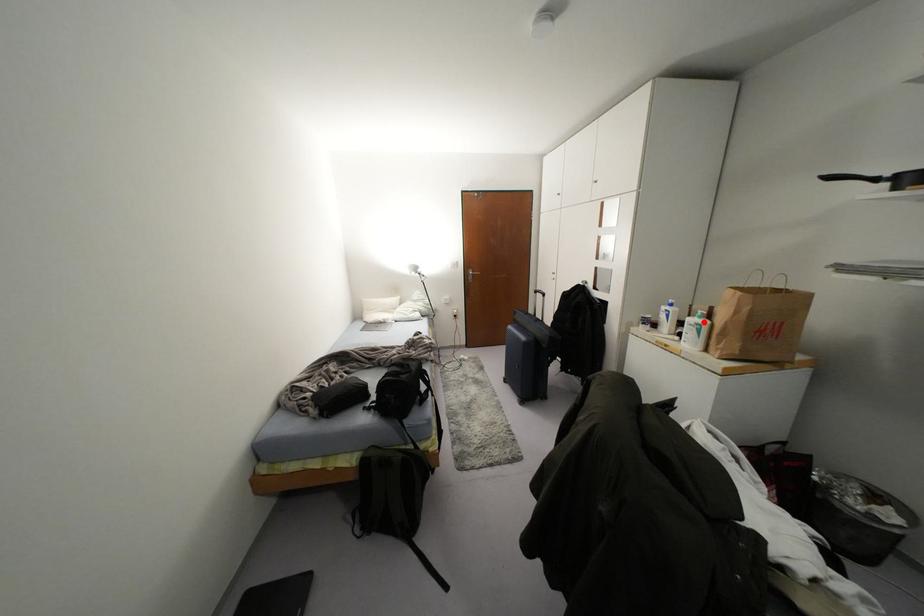
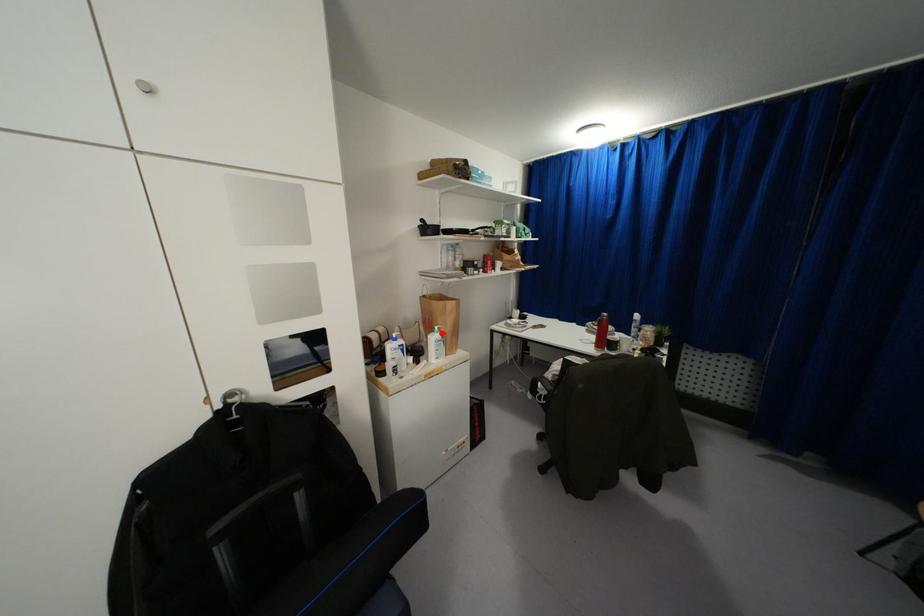
I am providing you with two images of the same scene from different viewpoints. A red point is marked on the first image and another point is marked on the second image. Does the point marked in image1 correspond to the same location as the one in image2?

Yes